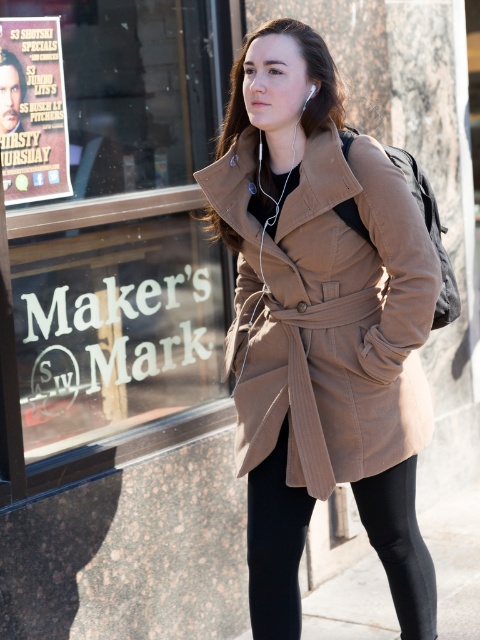
Who is more distant from viewer, (x=350, y=474) or (x=404, y=470)?

The point (x=404, y=470) is behind.

Between corduroy brown coat at center and black smooth leggings at lower center, which one is positioned lower?

black smooth leggings at lower center is lower down.

Does point (309, 276) lie in front of point (262, 525)?

Yes, it is in front of point (262, 525).

Where is `corduroy brown coat at center`? This screenshot has height=640, width=480. corduroy brown coat at center is located at coordinates (340, 324).

How far apart are corduroy brown coat at center and matte paper poster at upper left?

They are 1.32 meters apart.

Between corduroy brown coat at center and matte paper poster at upper left, which one has more height?

Standing taller between the two is corduroy brown coat at center.

Locate an element on the screen. corduroy brown coat at center is located at coordinates (340, 324).

Identify the location of corduroy brown coat at center. [340, 324].

Looking at this image, between black smooth leggings at lower center and matte paper poster at upper left, which one is positioned higher?

matte paper poster at upper left

Is black smooth leggings at lower center smaller than matte paper poster at upper left?

No.

Which is behind, point (387, 573) or point (54, 96)?

Positioned behind is point (54, 96).

Where is `black smooth leggings at lower center`? black smooth leggings at lower center is located at coordinates (276, 545).